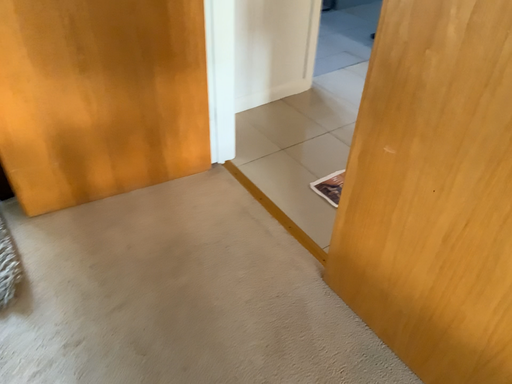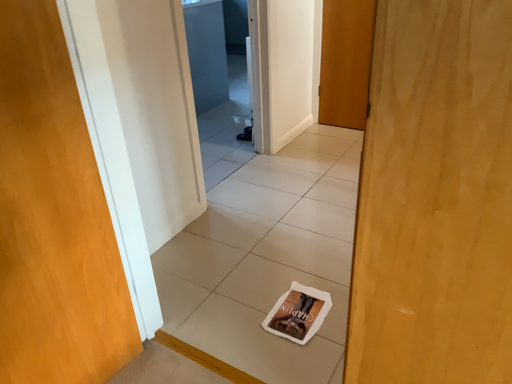
Question: How did the camera likely rotate when shooting the video?

Choices:
 (A) rotated upward
 (B) rotated downward

Answer: (A)